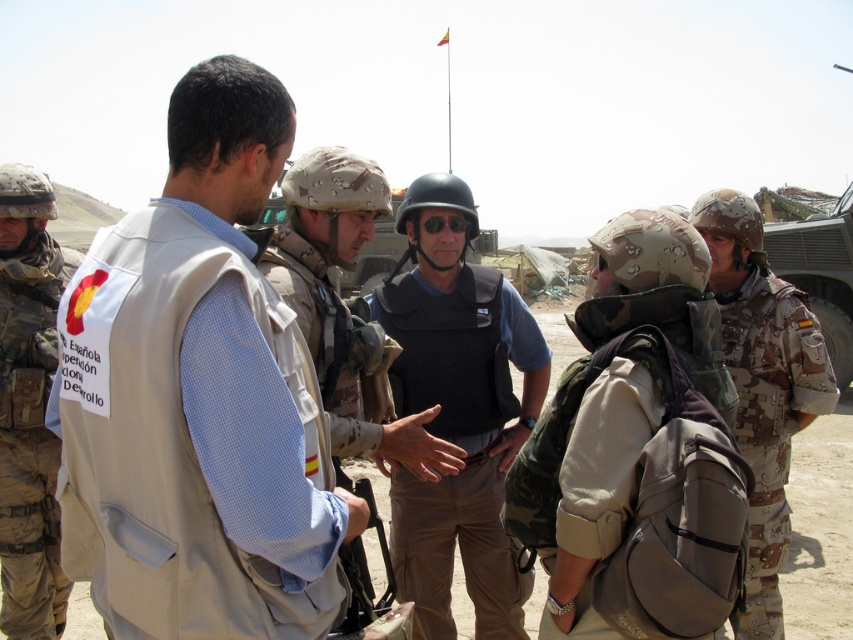
Question: Is camo fabric backpack at center thinner than camouflage fabric helmet at right?

Choices:
 (A) no
 (B) yes

Answer: (B)

Question: Which of these objects is positioned closest to the black matte vest at center?

Choices:
 (A) camouflage fabric helmet at left
 (B) camouflage fabric helmet at right
 (C) light beige vest at center
 (D) camo fabric backpack at center

Answer: (C)

Question: Where is camo fabric backpack at center located in relation to light beige vest at center in the image?

Choices:
 (A) above
 (B) below

Answer: (B)

Question: Based on their relative distances, which object is farther from the camouflage fabric helmet at left?

Choices:
 (A) light beige vest at center
 (B) camouflage fabric helmet at right
 (C) beige fabric vest at center

Answer: (B)

Question: Can you confirm if black matte vest at center is bigger than camouflage fabric helmet at left?

Choices:
 (A) yes
 (B) no

Answer: (A)

Question: Which of these objects is positioned farthest from the black matte vest at center?

Choices:
 (A) camo fabric backpack at center
 (B) camouflage fabric helmet at left

Answer: (B)